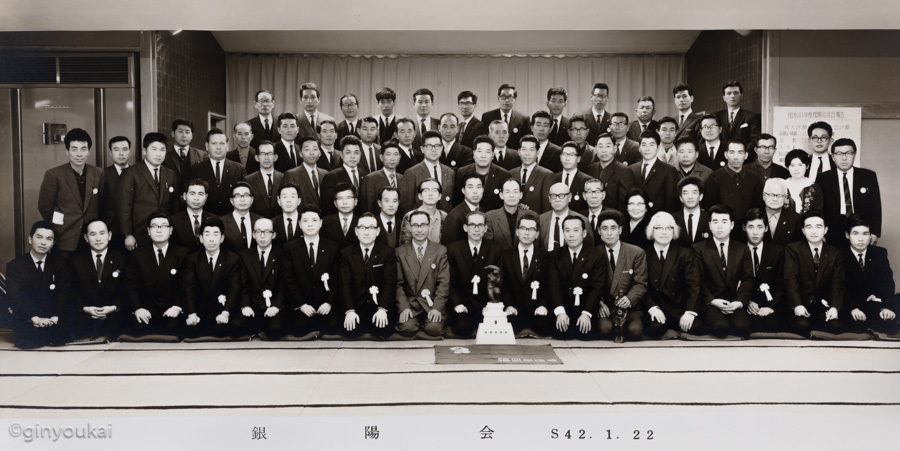
The width and height of the screenshot is (900, 451). What are the coordinates of `brick wall` in the screenshot? It's located at point(201,71), point(712,52).